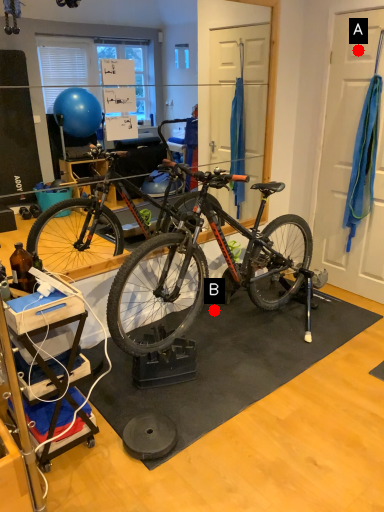
Question: Two points are circled on the image, labeled by A and B beside each circle. Which point is farther to the camera?

Choices:
 (A) A is further
 (B) B is further

Answer: (B)